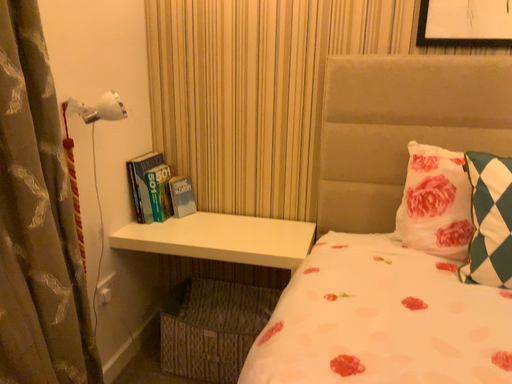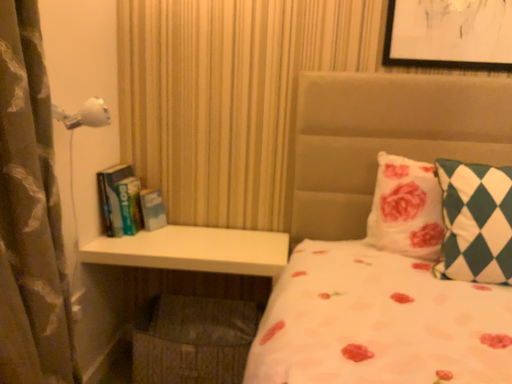
Question: Which way did the camera rotate in the video?

Choices:
 (A) rotated right
 (B) rotated left

Answer: (A)